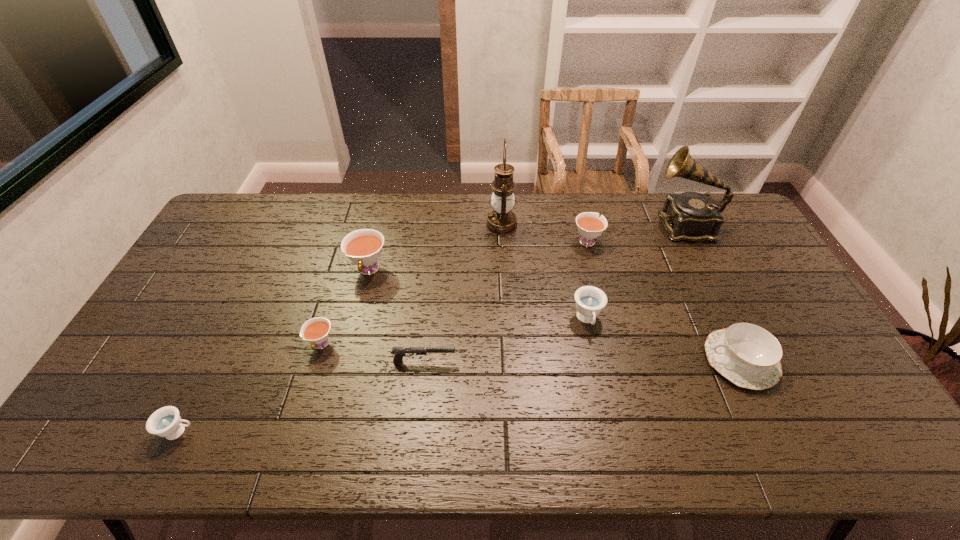
You are a GUI agent. You are given a task and a screenshot of the screen. Output one action in this format:
    pyautogui.click(x=<x>, y=<y>)
    Task: Click on the oil lamp located in the far edge section of the desktop
    
    Given the screenshot: What is the action you would take?
    pyautogui.click(x=501, y=221)

The height and width of the screenshot is (540, 960). What are the coordinates of `phonograph record at the far edge` in the screenshot? It's located at (691, 216).

Identify the location of teacup that is at the far edge. point(590,226).

This screenshot has height=540, width=960. I want to click on object at the near edge, so click(166, 422).

Locate an element on the screen. The height and width of the screenshot is (540, 960). phonograph record positioned at the right edge is located at coordinates (691, 216).

I want to click on chinaware positioned at the right edge, so click(x=748, y=355).

This screenshot has width=960, height=540. Find the location of `object located in the far right corner section of the desktop`. object located in the far right corner section of the desktop is located at coordinates (691, 216).

At what (x,y) coordinates should I click in order to perform the action: click on vacant space at the far edge. Please return your answer as a coordinate pair (x, y). Looking at the image, I should click on (437, 231).

Where is `vacant space at the left edge`? This screenshot has height=540, width=960. vacant space at the left edge is located at coordinates (252, 237).

In the image, there is a desktop. Where is `vacant space at the right edge`? This screenshot has width=960, height=540. vacant space at the right edge is located at coordinates (799, 380).